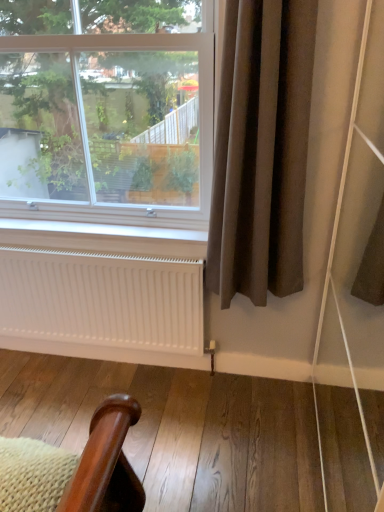
In order to click on vacant area that is situated to the right of white matte radiator at lower center in this screenshot , I will do `click(215, 409)`.